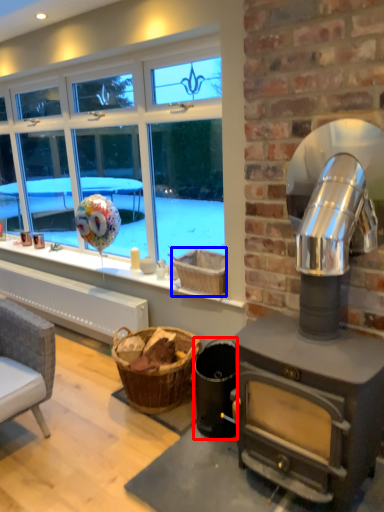
Question: Among these objects, which one is nearest to the camera, appliance (highlighted by a red box) or basket (highlighted by a blue box)?

Choices:
 (A) appliance
 (B) basket

Answer: (A)